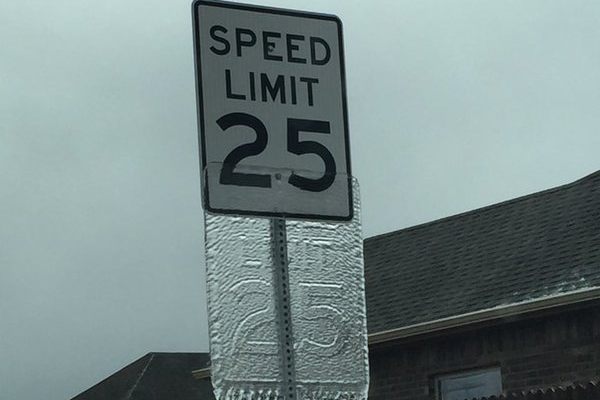
The width and height of the screenshot is (600, 400). I want to click on house window, so click(x=460, y=381).